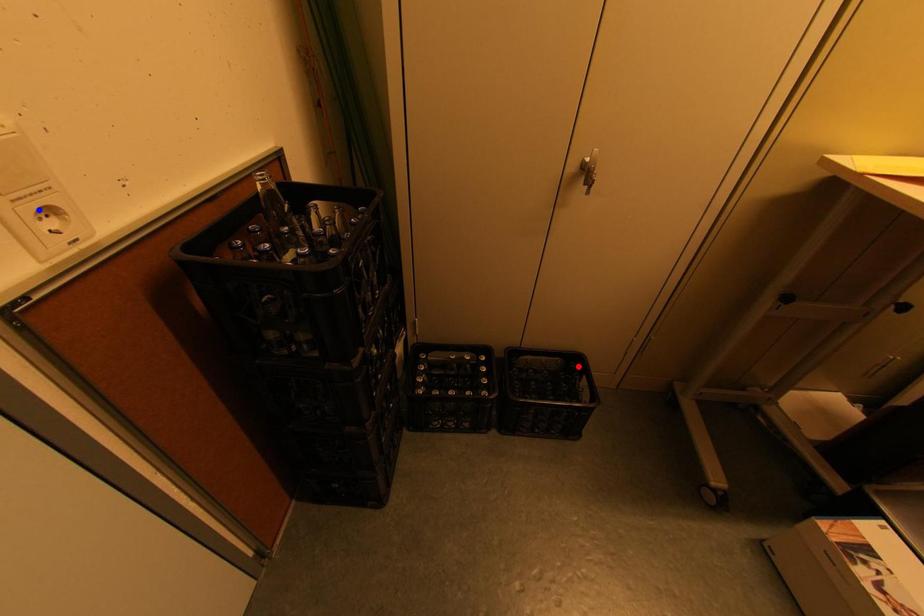
Question: Which of the two points in the image is closer to the camera?

Choices:
 (A) Blue point is closer.
 (B) Red point is closer.

Answer: (A)